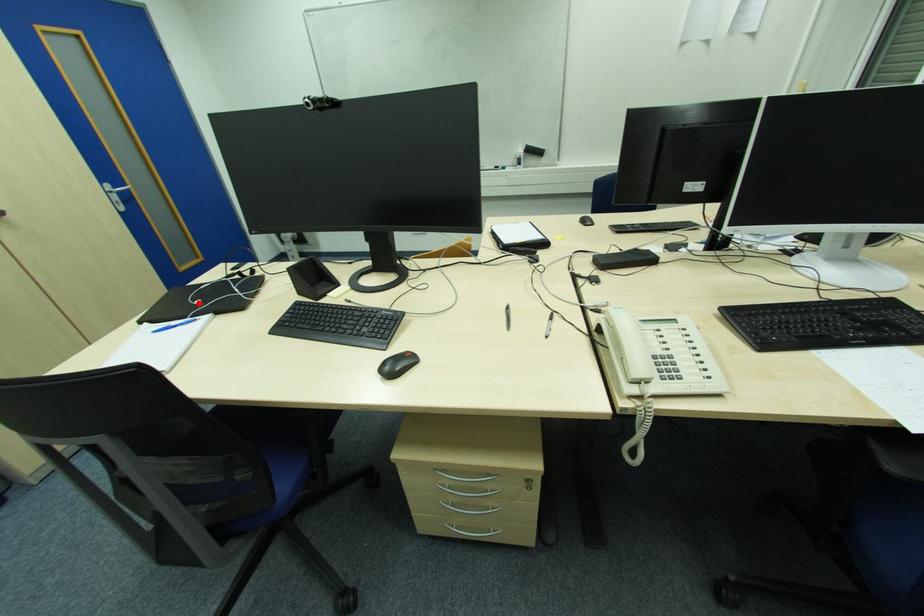
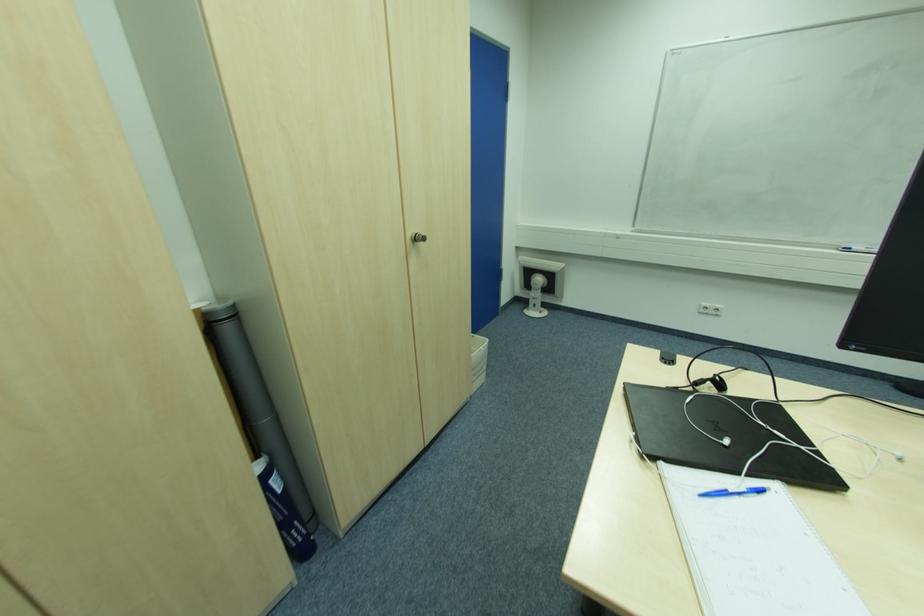
Locate, in the second image, the point that corresponds to the highlighted location in the first image.

(728, 443)